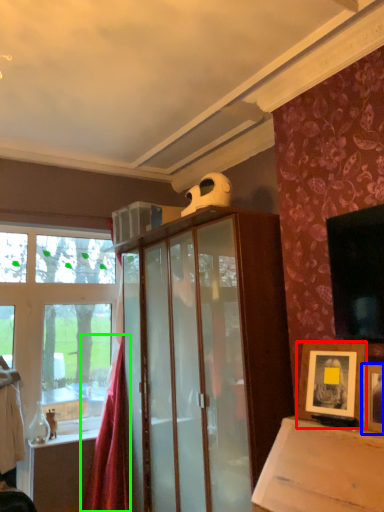
Question: Based on their relative distances, which object is nearer to picture frame (highlighted by a red box)? Choose from picture frame (highlighted by a blue box) and curtain (highlighted by a green box).

Choices:
 (A) picture frame
 (B) curtain

Answer: (A)